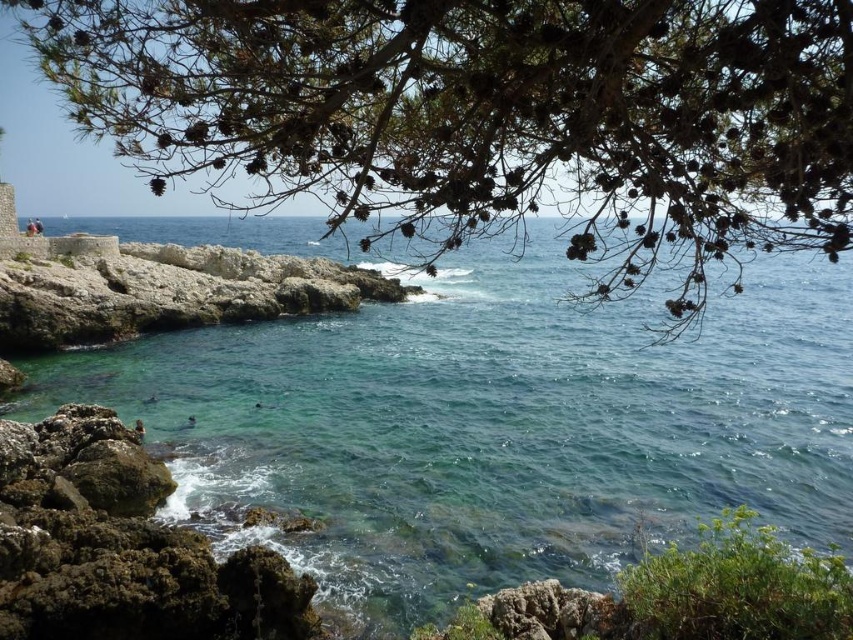
Question: Among these points, which one is nearest to the camera?

Choices:
 (A) (54, 288)
 (B) (701, 252)

Answer: (B)

Question: Is clear water at center smaller than green textured pine branches at upper center?

Choices:
 (A) no
 (B) yes

Answer: (A)

Question: Does clear water at center appear over green textured pine branches at upper center?

Choices:
 (A) no
 (B) yes

Answer: (B)

Question: Considering the real-world distances, which object is closest to the green mossy rock at lower left?

Choices:
 (A) rough stone wall at left
 (B) clear water at center
 (C) green textured pine branches at upper center

Answer: (C)

Question: Among these points, which one is nearest to the camera?

Choices:
 (A) (444, 449)
 (B) (228, 276)
 (C) (231, 129)

Answer: (C)

Question: Is clear water at center behind green textured pine branches at upper center?

Choices:
 (A) no
 (B) yes

Answer: (B)